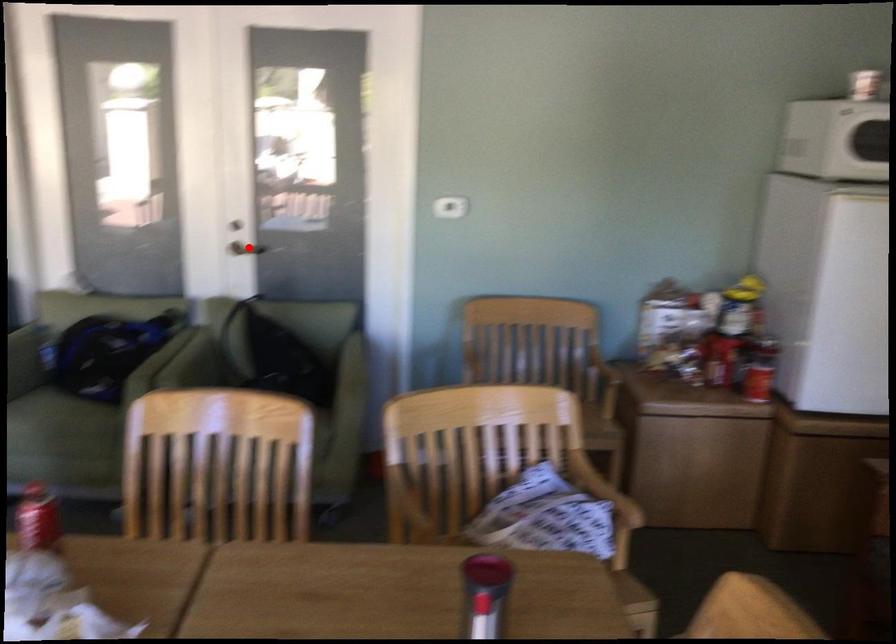
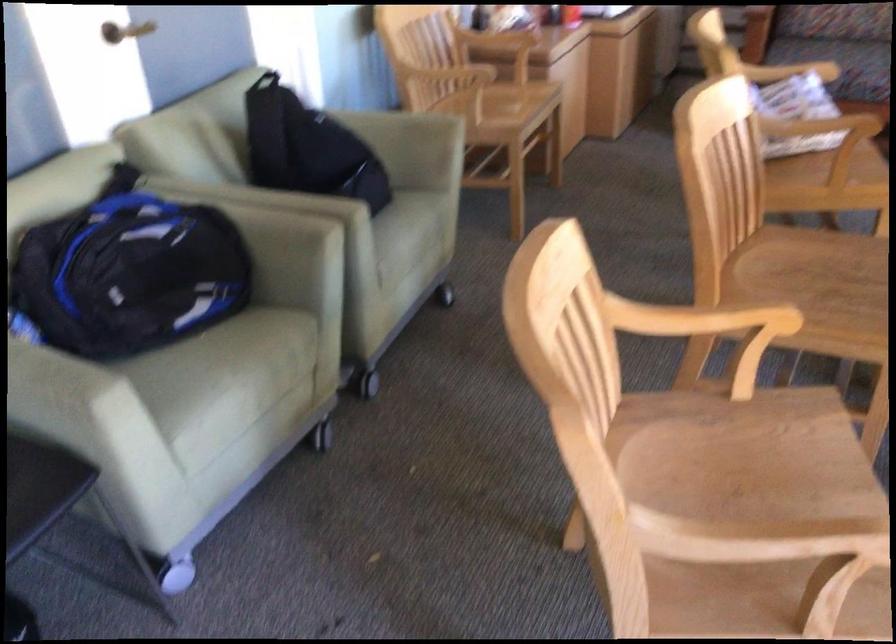
In the second image, find the point that corresponds to the highlighted location in the first image.

(125, 31)